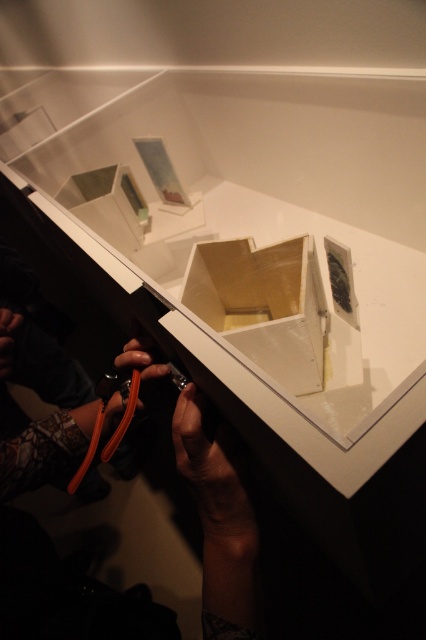
You are an art curator examining the display case. You need to place a small sculpture that requires 10 cm of vertical space. Can the white glossy box at center or the matte plastic box at upper left accommodate it?

The white glossy box at center has a greater height compared to the matte plastic box at upper left. Therefore, the white glossy box at center is more likely to accommodate the sculpture requiring 10 cm of vertical space.

You are an art curator examining the display case. You need to place a small label at point (218, 525). Which object is located at that point?

The orange rubber hose at lower left is located at point (218, 525).

You are an art curator planning to place a new sculpture that is 10 cm wide into the display case. Looking at the orange rubber hose at lower left and the matte plastic box at upper left, which object has a wider width that might interfere with placing the sculpture next to it?

The orange rubber hose at lower left has a larger width than the matte plastic box at upper left, so placing the sculpture next to it may be challenging due to the hose being wider.